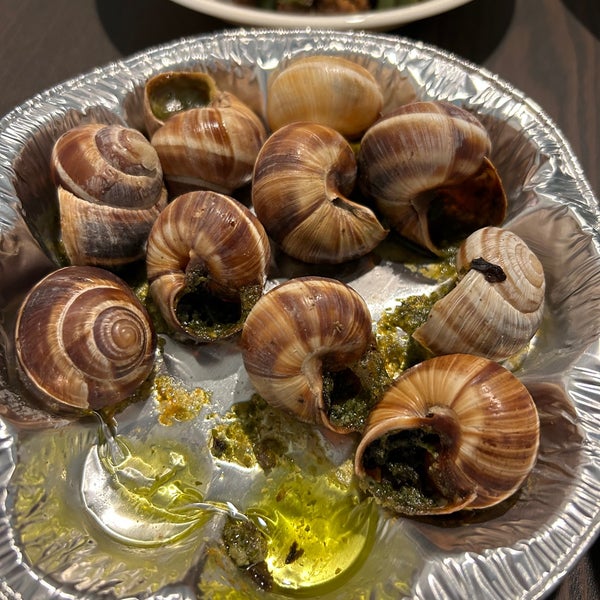
Where is `white plate`? white plate is located at coordinates (233, 13).